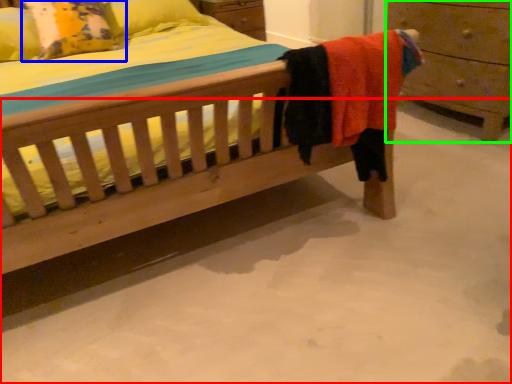
Question: Which object is the closest to the concrete (highlighted by a red box)? Choose among these: pillow (highlighted by a blue box) or chest of drawers (highlighted by a green box).

Choices:
 (A) pillow
 (B) chest of drawers

Answer: (B)